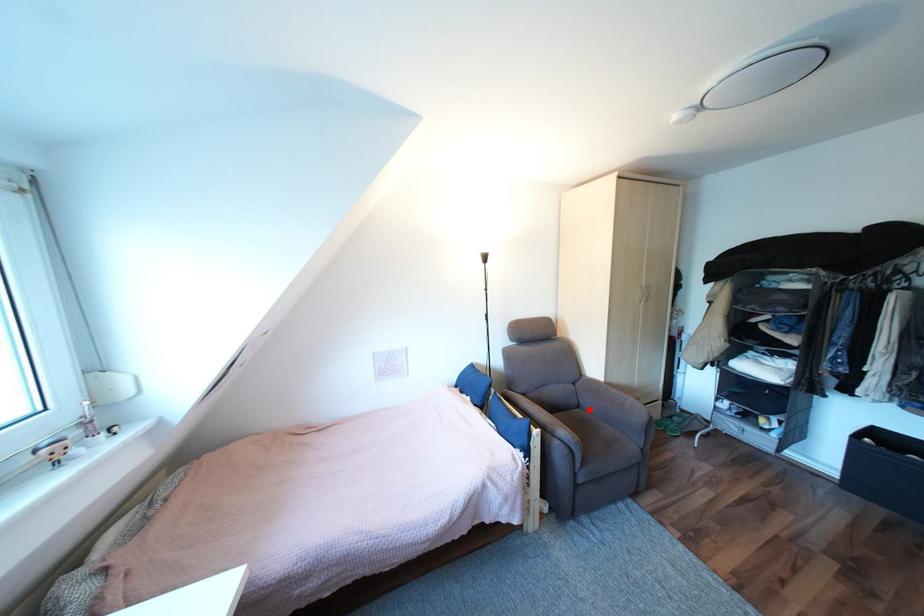
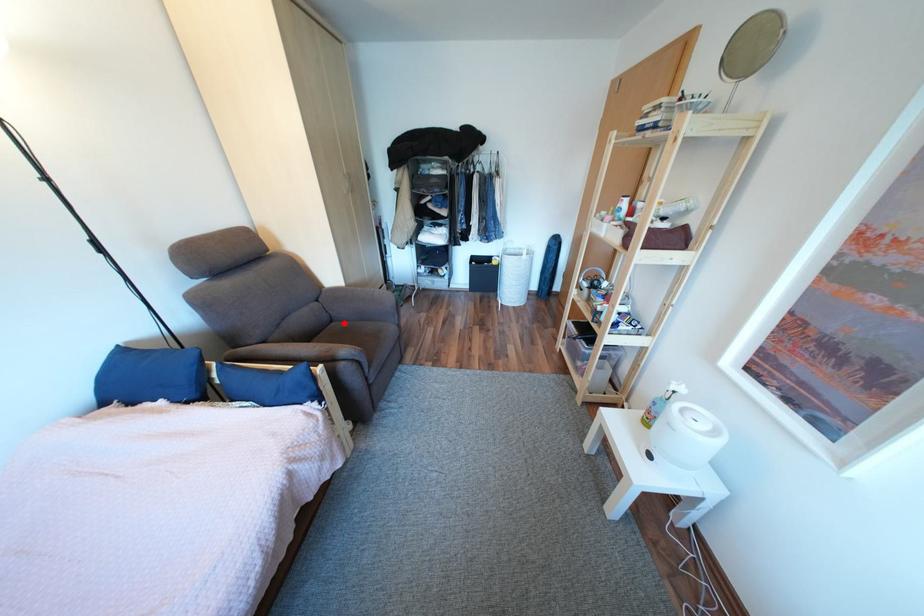
I am providing you with two images of the same scene from different viewpoints. A red point is marked on the first image and another point is marked on the second image. Are the points marked in image1 and image2 representing the same 3D position?

Yes